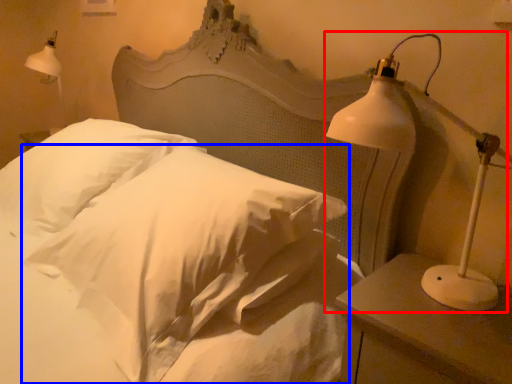
Question: Which point is further to the camera, lamp (highlighted by a red box) or pillow (highlighted by a blue box)?

Choices:
 (A) lamp
 (B) pillow

Answer: (B)